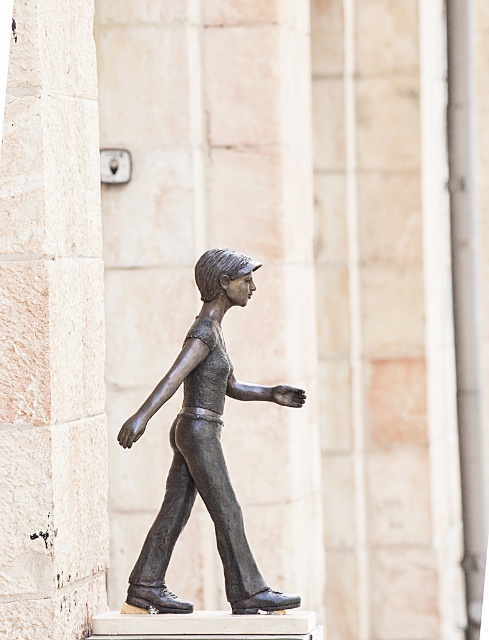
You are standing in front of the bronze sculpture and want to take a photo. You notice two points on the sculpture labeled as point (18, 624) and point (285, 403). Which point is closer to your camera?

Point (18, 624) is closer to the camera than point (285, 403).